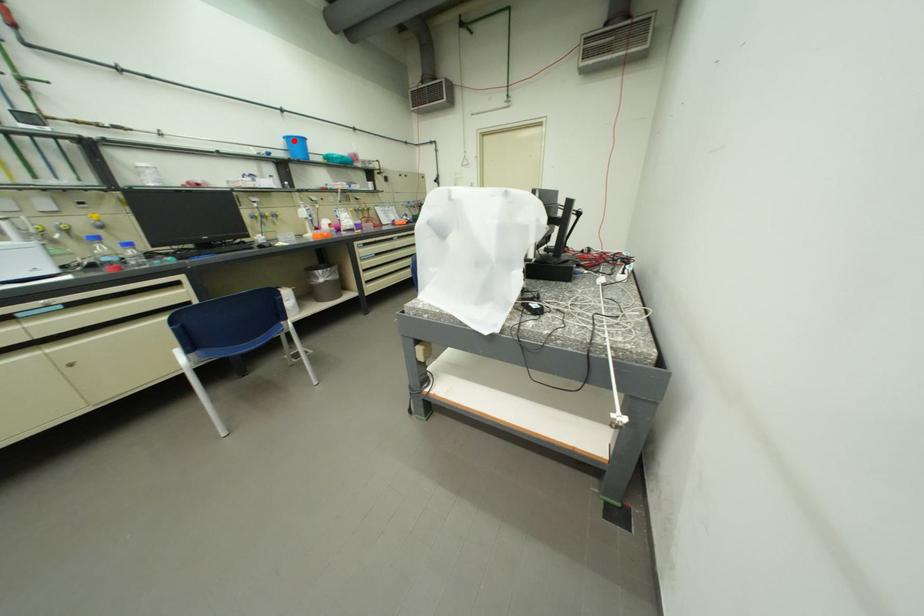
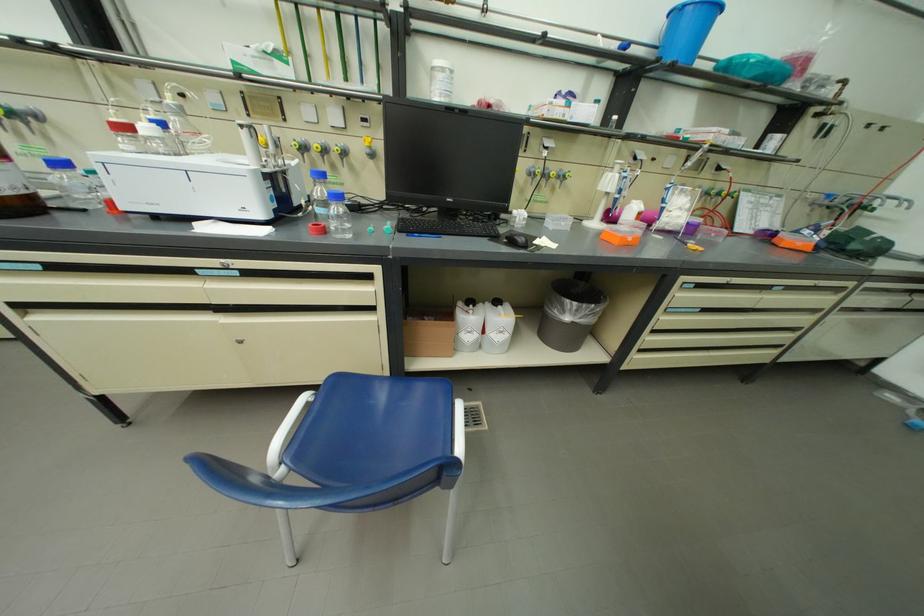
The point at the highlighted location is marked in the first image. Where is the corresponding point in the second image?

(677, 20)